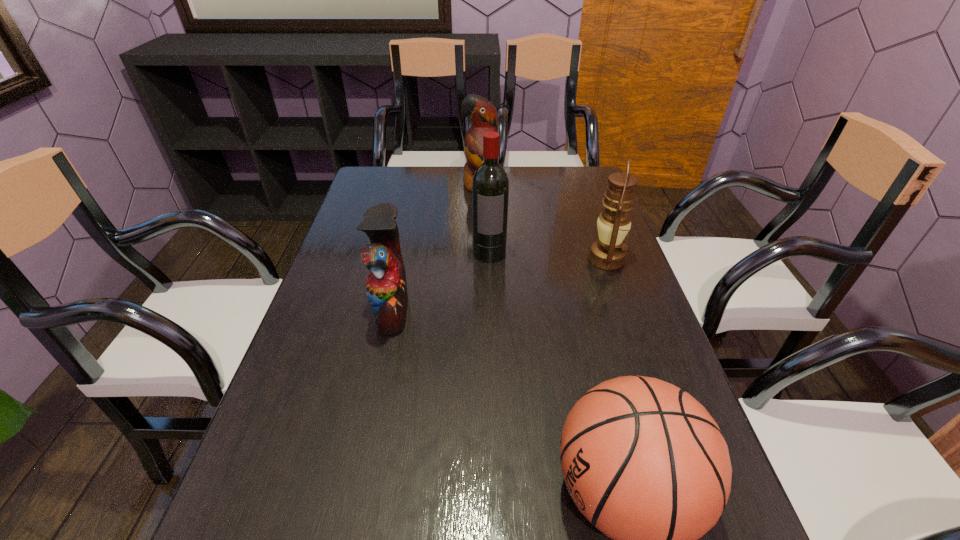
Locate an element on the screen. This screenshot has width=960, height=540. free space that is in between the shorter parrot and the farthest object is located at coordinates (437, 248).

Locate an element on the screen. The height and width of the screenshot is (540, 960). free space between the farthest object and the oil lamp is located at coordinates (543, 222).

This screenshot has height=540, width=960. Identify the location of object that is the fourth closest to the nearest object. (482, 113).

This screenshot has height=540, width=960. What are the coordinates of `object that ranks as the third closest to the basketball` in the screenshot? It's located at (490, 187).

You are a GUI agent. You are given a task and a screenshot of the screen. Output one action in this format:
    pyautogui.click(x=<x>, y=<y>)
    Task: Click on the free spot that satisfies the following two spatial constraints: 1. on the face of the right parrot; 2. on the right side of the oil lamp
    This screenshot has height=540, width=960.
    Given the screenshot: What is the action you would take?
    pyautogui.click(x=481, y=259)

You are a GUI agent. You are given a task and a screenshot of the screen. Output one action in this format:
    pyautogui.click(x=<x>, y=<y>)
    Task: Click on the vacant point that satisfies the following two spatial constraints: 1. on the face of the farther parrot; 2. at the face of the left parrot
    The height and width of the screenshot is (540, 960).
    Given the screenshot: What is the action you would take?
    tap(482, 309)

At what (x,y) coordinates should I click in order to perform the action: click on vacant region that satisfies the following two spatial constraints: 1. on the label of the wine bottle; 2. on the left side of the oil lamp. Please return your answer as a coordinate pair (x, y). The height and width of the screenshot is (540, 960). Looking at the image, I should click on [x=490, y=259].